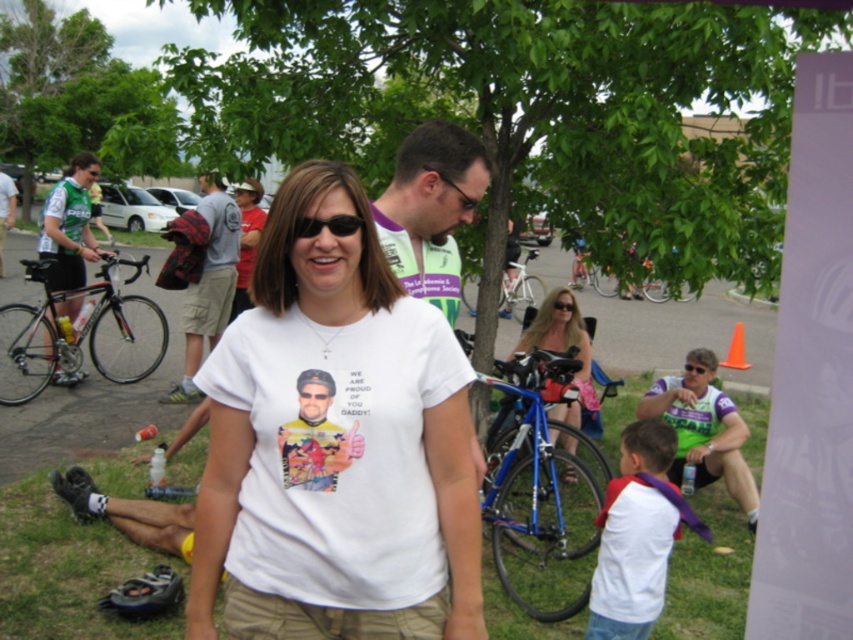
Is white cotton t-shirt at lower right wider than shiny black frame bicycle at left?

No.

Does white cotton t-shirt at lower right come behind shiny black frame bicycle at left?

No, it is not.

Is point (630, 522) less distant than point (61, 337)?

Yes.

Where is `white cotton t-shirt at lower right`? white cotton t-shirt at lower right is located at coordinates (637, 534).

Which is behind, point (77, 342) or point (560, 412)?

Positioned behind is point (77, 342).

Where is `shiny black frame bicycle at left`? shiny black frame bicycle at left is located at coordinates (79, 333).

Is point (506, 444) in front of point (202, 321)?

Yes, point (506, 444) is closer to viewer.

Does blue metallic bicycle at center appear on the right side of gray cotton t-shirt at center?

Indeed, blue metallic bicycle at center is positioned on the right side of gray cotton t-shirt at center.

Between point (515, 476) and point (190, 228), which one is positioned in front?

Point (515, 476)

I want to click on blue metallic bicycle at center, so click(540, 492).